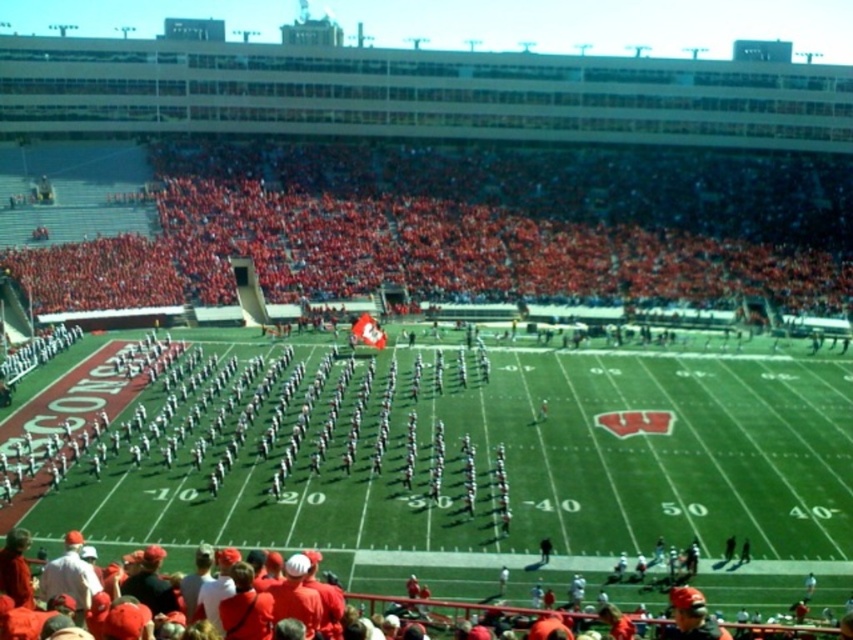
You are a photographer at the football stadium and want to capture a photo of the white uniformed band at center without any obstructions. Are the red fabric seats at upper center blocking your view of the band?

The white uniformed band at center is behind the red fabric seats at upper center, so the seats are blocking the view of the band.

You are a photographer trying to capture the entire marching band formation and the stadium seats in one shot. Based on the scene, which object, the red fabric seats at upper center or the white uniformed band at center, would appear bigger in the photo?

The red fabric seats at upper center would appear bigger in the photo because they are larger in size than the white uniformed band at center.

You are a photographer positioned at the field level. You need to capture a photo of the marching band members in white uniforms. To avoid including the red fabric seats at upper center in your shot, should you adjust your camera angle upwards or downwards?

To avoid including the red fabric seats at upper center, you should adjust your camera angle downwards since the red fabric seats at upper center are located at point (468,227), which is above the photographer at field level.